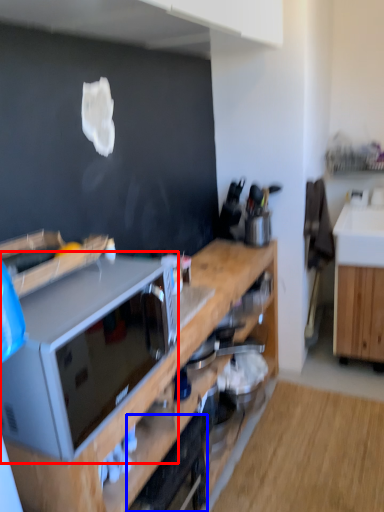
Question: Which point is further to the camera, microwave oven (highlighted by a red box) or appliance (highlighted by a blue box)?

Choices:
 (A) microwave oven
 (B) appliance

Answer: (B)